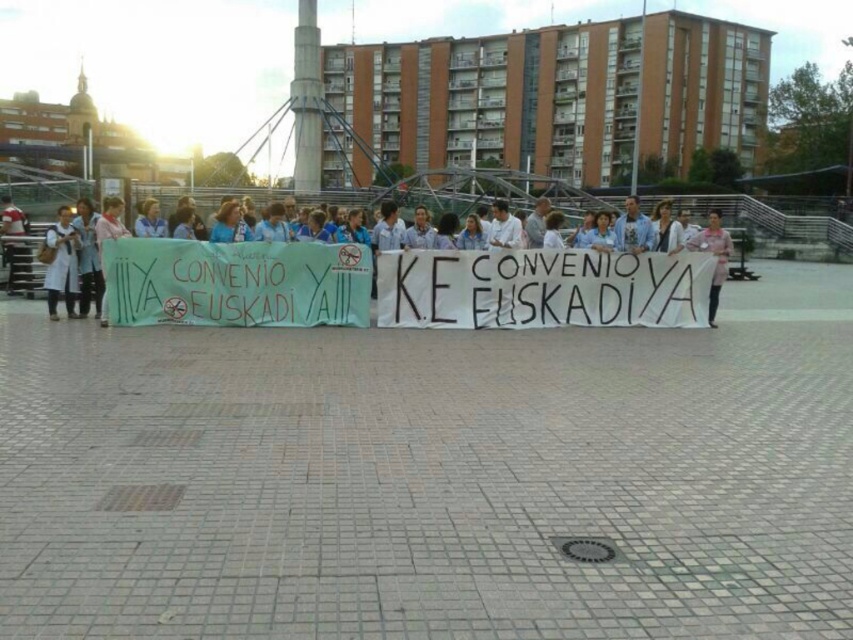
Describe the element at coordinates (399, 285) in the screenshot. This screenshot has height=640, width=853. I see `light blue shirt at center` at that location.

Where is `light blue shirt at center`? Image resolution: width=853 pixels, height=640 pixels. light blue shirt at center is located at coordinates (399, 285).

Find the location of a particular element. The image size is (853, 640). light blue shirt at center is located at coordinates (399, 285).

Which is more to the right, light blue shirt at center or pink fabric at center?

pink fabric at center

Can you confirm if light blue shirt at center is shorter than pink fabric at center?

Yes, light blue shirt at center is shorter than pink fabric at center.

In order to click on light blue shirt at center in this screenshot , I will do `click(399, 285)`.

The height and width of the screenshot is (640, 853). I want to click on light blue shirt at left, so click(x=61, y=262).

Is light blue shirt at left positioned in front of pink fabric at center?

Yes, light blue shirt at left is in front of pink fabric at center.

Is point (73, 276) farther from viewer compared to point (729, 250)?

No, it is in front of (729, 250).

Find the location of a particular element. Image resolution: width=853 pixels, height=640 pixels. light blue shirt at left is located at coordinates (61, 262).